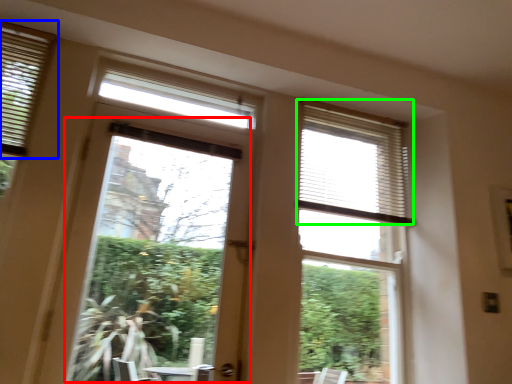
Question: Which object is the farthest from window screen (highlighted by a red box)? Choose among these: window blind (highlighted by a blue box) or blind (highlighted by a green box).

Choices:
 (A) window blind
 (B) blind

Answer: (A)